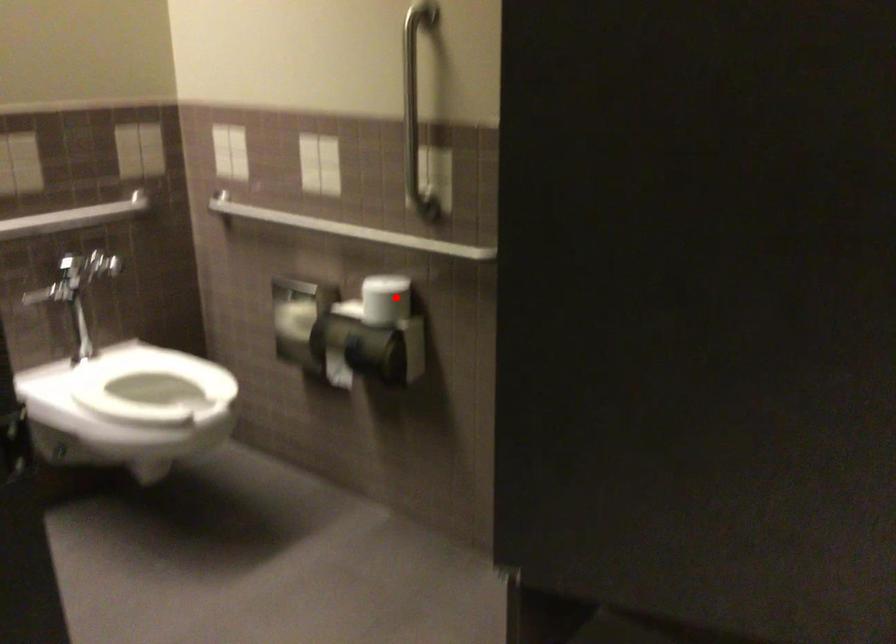
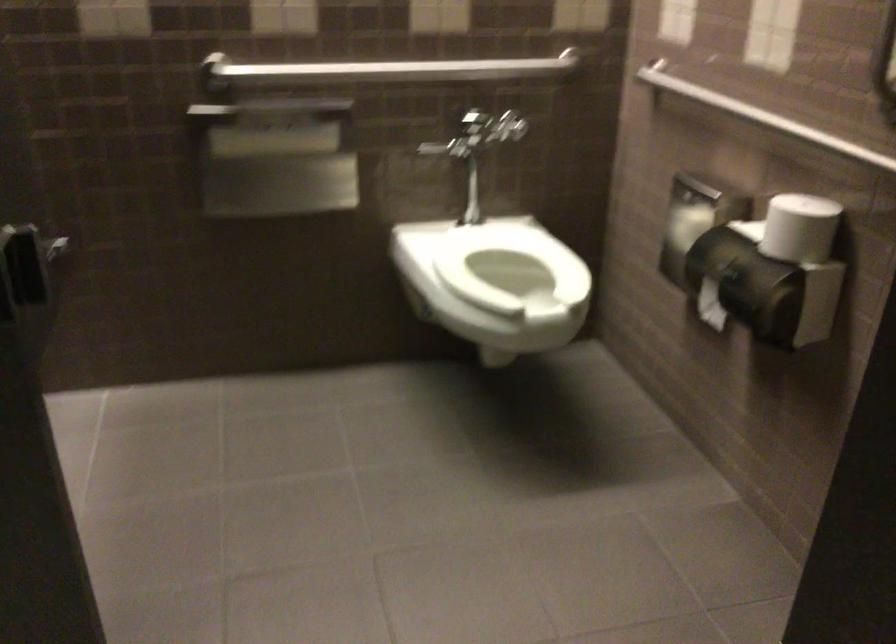
Where in the second image is the point corresponding to the highlighted location from the first image?

(799, 228)